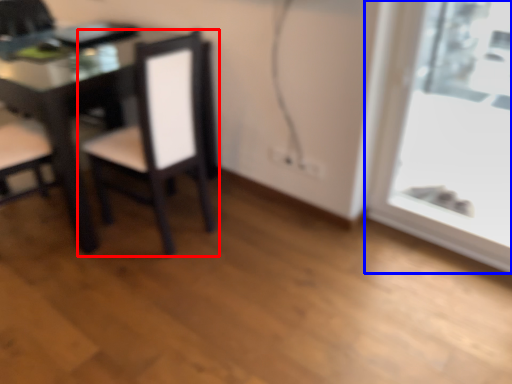
Question: Among these objects, which one is farthest to the camera, chair (highlighted by a red box) or window (highlighted by a blue box)?

Choices:
 (A) chair
 (B) window

Answer: (A)